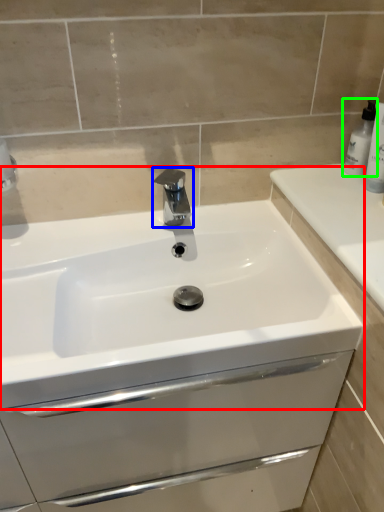
Question: Which object is the farthest from sink (highlighted by a red box)? Choose among these: tap (highlighted by a blue box) or soap dispenser (highlighted by a green box).

Choices:
 (A) tap
 (B) soap dispenser

Answer: (B)